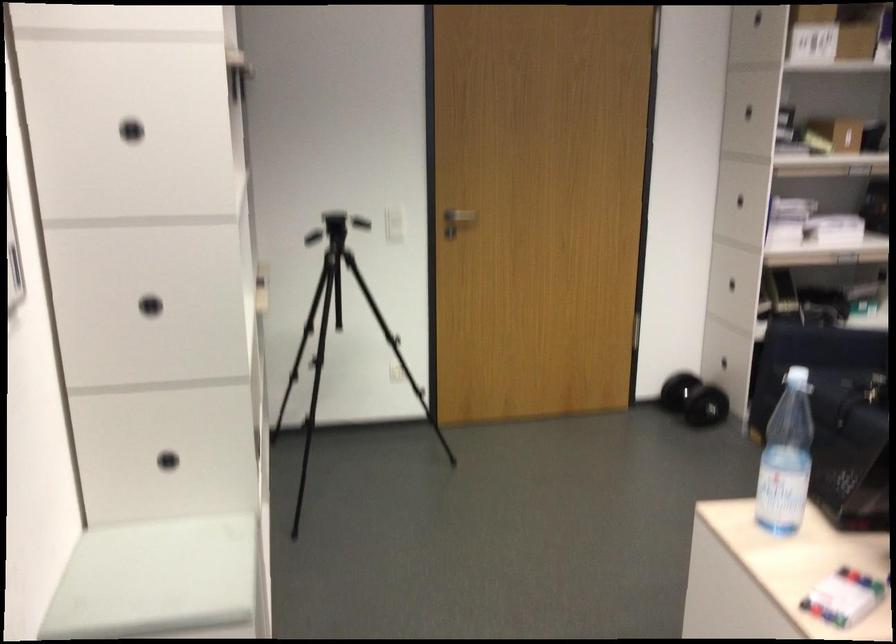
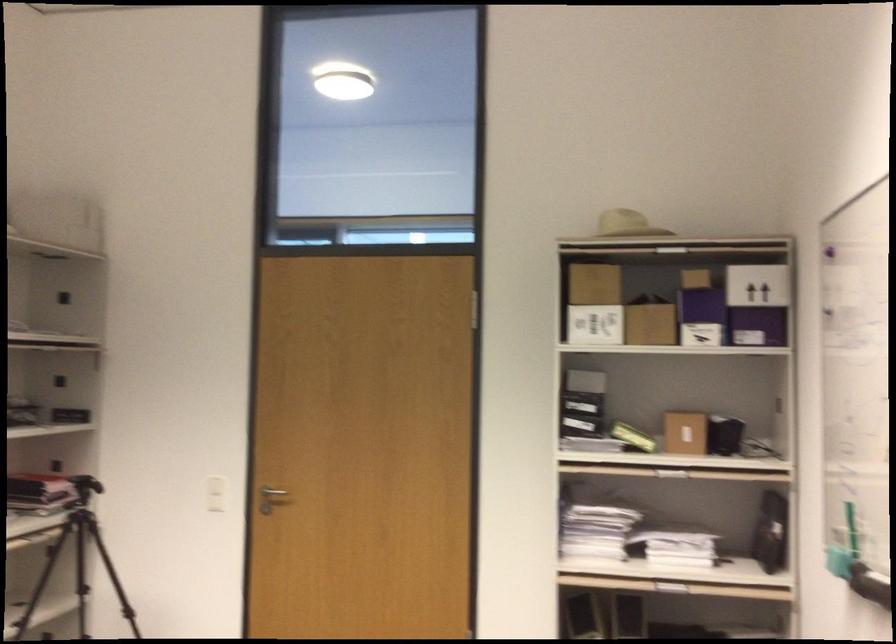
Locate, in the second image, the point that corresponds to pixel 364 223 in the first image.

(216, 494)